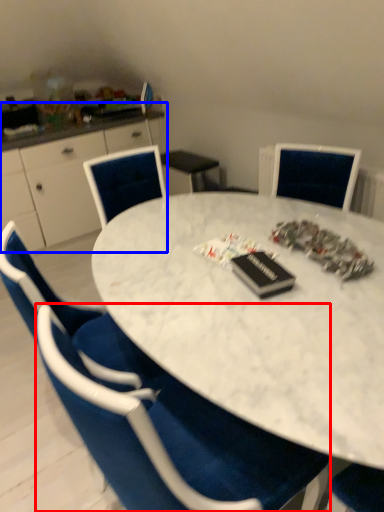
Question: Which point is further to the camera, chair (highlighted by a red box) or computer desk (highlighted by a blue box)?

Choices:
 (A) chair
 (B) computer desk

Answer: (B)